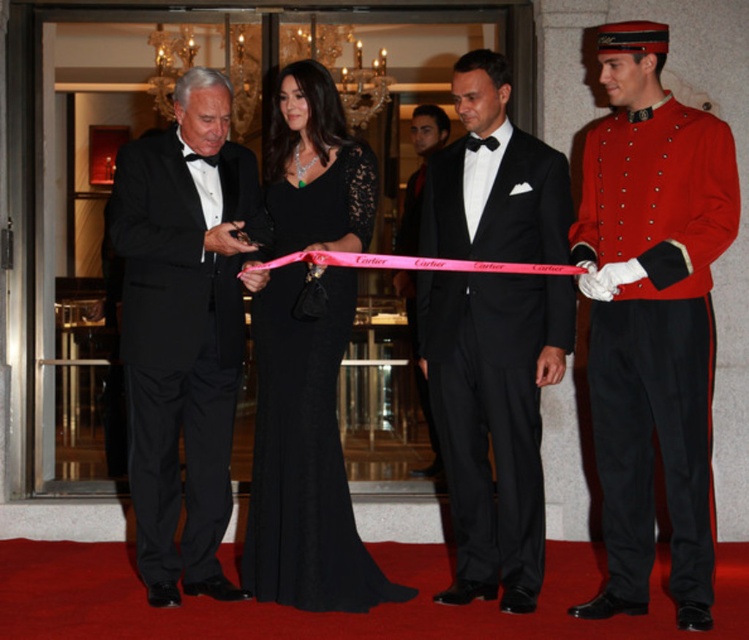
Question: Which object is closer to the camera taking this photo?

Choices:
 (A) black satin suit at center
 (B) black satin tuxedo at center
 (C) black lace dress at center

Answer: (C)

Question: Which of the following is the farthest from the observer?

Choices:
 (A) (258, 292)
 (B) (418, 104)
 (C) (218, 356)
 (D) (582, 218)

Answer: (B)

Question: Can you confirm if matte black tuxedo at left is positioned below black satin suit at center?

Choices:
 (A) no
 (B) yes

Answer: (B)

Question: Among these objects, which one is nearest to the camera?

Choices:
 (A) matte black tuxedo at left
 (B) black satin suit at center
 (C) black lace dress at center

Answer: (C)

Question: Is red cotton uniform at right wider than black satin tuxedo at center?

Choices:
 (A) no
 (B) yes

Answer: (A)

Question: Does red cotton uniform at right appear over black lace dress at center?

Choices:
 (A) no
 (B) yes

Answer: (B)